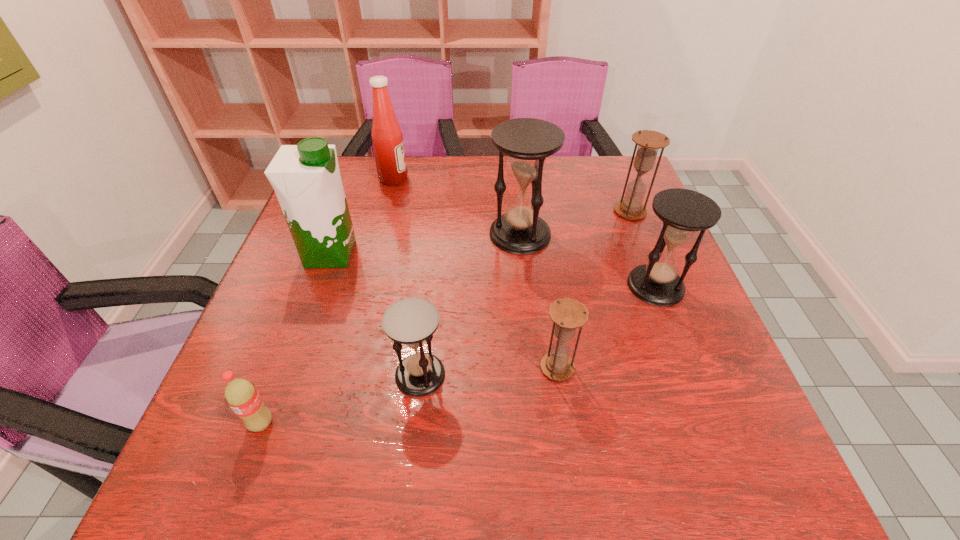
You are a GUI agent. You are given a task and a screenshot of the screen. Output one action in this format:
    pyautogui.click(x=<x>, y=<y>)
    Task: Click on the condiment
    Image resolution: width=960 pixels, height=540 pixels.
    Given the screenshot: What is the action you would take?
    pyautogui.click(x=387, y=138)

In order to click on the farthest object in this screenshot , I will do `click(387, 138)`.

Identify the location of soya milk. (306, 178).

You are a GUI agent. You are given a task and a screenshot of the screen. Output one action in this format:
    pyautogui.click(x=<x>, y=<y>)
    Task: Click on the tallest hourglass
    The height and width of the screenshot is (540, 960).
    Given the screenshot: What is the action you would take?
    pyautogui.click(x=527, y=142)

Find the location of a particular element. This screenshot has width=960, height=540. the biggest black hourglass is located at coordinates tap(527, 142).

In order to click on the third nearest hourglass in this screenshot , I will do `click(683, 212)`.

Where is `the rightmost black hourglass`? The height and width of the screenshot is (540, 960). the rightmost black hourglass is located at coordinates (683, 212).

In order to click on the bigger brown hourglass in this screenshot , I will do `click(649, 142)`.

Where is `the right brown hourglass`? The height and width of the screenshot is (540, 960). the right brown hourglass is located at coordinates (649, 142).

Locate an element on the screen. the nearer brown hourglass is located at coordinates (567, 314).